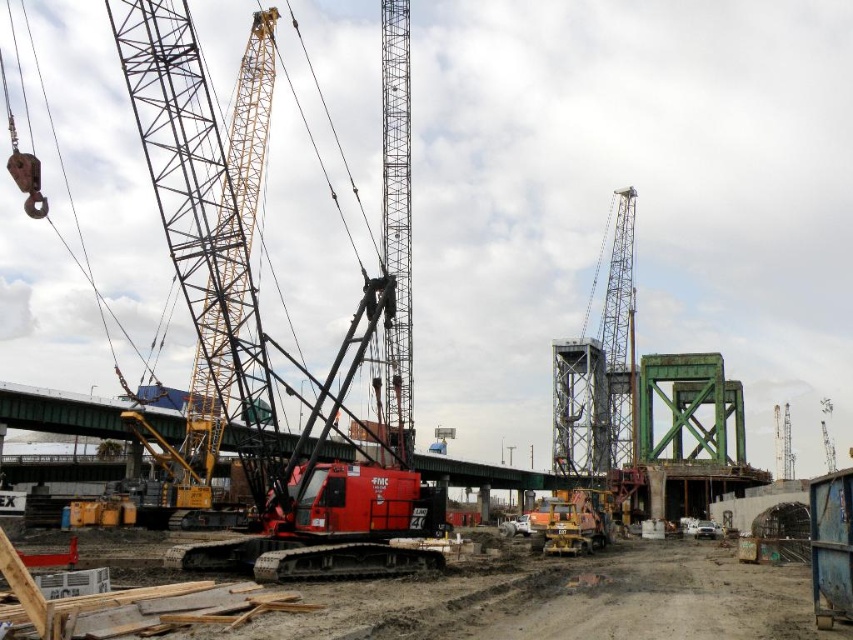
Question: Is yellow metallic crane at left above metallic gray crane at center?

Choices:
 (A) yes
 (B) no

Answer: (A)

Question: Does yellow metallic crane at left have a smaller size compared to metallic gray crane at center?

Choices:
 (A) yes
 (B) no

Answer: (B)

Question: Which point appears farthest from the camera in this image?

Choices:
 (A) (785, 442)
 (B) (257, 58)

Answer: (A)

Question: Is yellow metallic crane at left to the right of metallic gray crane at center from the viewer's perspective?

Choices:
 (A) yes
 (B) no

Answer: (B)